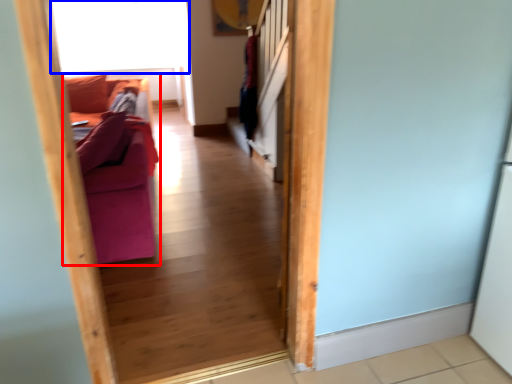
Question: Which point is closer to the camera, furniture (highlighted by a red box) or window screen (highlighted by a blue box)?

Choices:
 (A) furniture
 (B) window screen

Answer: (A)